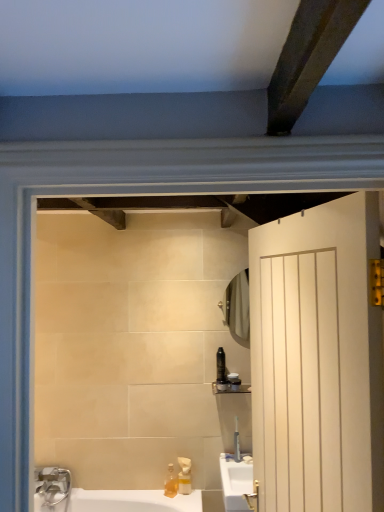
The height and width of the screenshot is (512, 384). What do you see at coordinates (222, 384) in the screenshot?
I see `translucent plastic bottle at upper center, which is counted as the 3th toiletry, starting from the top` at bounding box center [222, 384].

The image size is (384, 512). Find the location of `translucent plastic soap dispenser at lower center, the 1th soap dispenser positioned from the right`. translucent plastic soap dispenser at lower center, the 1th soap dispenser positioned from the right is located at coordinates (184, 476).

Where is `white wood door at right`? This screenshot has width=384, height=512. white wood door at right is located at coordinates (317, 359).

Measure the distance between point (218, 373) and camera.

They are 7.93 feet apart.

What do you see at coordinates (237, 306) in the screenshot?
I see `matte glass mirror at upper center` at bounding box center [237, 306].

Locate an element on the screen. translucent plastic bottle at upper center, placed as the second toiletry when sorted from bottom to top is located at coordinates [x=222, y=384].

Is clear plastic tube at upper center, positioned as the fourth toiletry in top-to-bottom order, far from translucent plastic soap dispenser at lower center, placed as the first soap dispenser when sorted from left to right?

That's not correct — clear plastic tube at upper center, positioned as the fourth toiletry in top-to-bottom order, is a little close to translucent plastic soap dispenser at lower center, placed as the first soap dispenser when sorted from left to right.

What's the angular difference between clear plastic tube at upper center, positioned as the fourth toiletry in top-to-bottom order, and translucent plastic soap dispenser at lower center, arranged as the 2th soap dispenser when viewed from the right,'s facing directions?

clear plastic tube at upper center, positioned as the fourth toiletry in top-to-bottom order, and translucent plastic soap dispenser at lower center, arranged as the 2th soap dispenser when viewed from the right, are facing 81.3 degrees away from each other.

Is clear plastic tube at upper center, positioned as the fourth toiletry in top-to-bottom order, oriented towards translucent plastic soap dispenser at lower center, placed as the first soap dispenser when sorted from left to right?

No, clear plastic tube at upper center, positioned as the fourth toiletry in top-to-bottom order, is not aimed at translucent plastic soap dispenser at lower center, placed as the first soap dispenser when sorted from left to right.

From the image's perspective, is clear plastic tube at upper center, which ranks as the first toiletry in bottom-to-top order, located above or below translucent plastic soap dispenser at lower center, arranged as the 2th soap dispenser when viewed from the right?

Based on their image positions, clear plastic tube at upper center, which ranks as the first toiletry in bottom-to-top order, is located above translucent plastic soap dispenser at lower center, arranged as the 2th soap dispenser when viewed from the right.

The height and width of the screenshot is (512, 384). Find the location of `the 4th toiletry in front of the matte glass mirror at upper center`. the 4th toiletry in front of the matte glass mirror at upper center is located at coordinates (222, 384).

Which is in front, point (229, 311) or point (216, 383)?

The point (216, 383) is more forward.

Is translucent plastic bottle at upper center, placed as the second toiletry when sorted from bottom to top, at the back of matte glass mirror at upper center?

No, matte glass mirror at upper center is not facing the opposite direction of translucent plastic bottle at upper center, placed as the second toiletry when sorted from bottom to top.

Looking at this image, does matte glass mirror at upper center have a larger size compared to translucent plastic bottle at upper center, which is counted as the 3th toiletry, starting from the top?

Yes.

Is translucent plastic soap dispenser at lower center, placed as the first soap dispenser when sorted from left to right, not near matte black container at upper right, the 2th toiletry in the top-to-bottom sequence?

translucent plastic soap dispenser at lower center, placed as the first soap dispenser when sorted from left to right, is near matte black container at upper right, the 2th toiletry in the top-to-bottom sequence, not far away.

Looking at this image, which of these two, translucent plastic soap dispenser at lower center, placed as the first soap dispenser when sorted from left to right, or matte black container at upper right, the 2th toiletry in the top-to-bottom sequence, stands taller?

Standing taller between the two is translucent plastic soap dispenser at lower center, placed as the first soap dispenser when sorted from left to right.

What's the angular difference between translucent plastic soap dispenser at lower center, placed as the first soap dispenser when sorted from left to right, and matte black container at upper right, which is the 3th toiletry from bottom to top,'s facing directions?

There is a 30.5-degree angle between the facing directions of translucent plastic soap dispenser at lower center, placed as the first soap dispenser when sorted from left to right, and matte black container at upper right, which is the 3th toiletry from bottom to top.

Is translucent plastic soap dispenser at lower center, placed as the first soap dispenser when sorted from left to right, closer to the viewer compared to matte black container at upper right, which is the 3th toiletry from bottom to top?

Yes, translucent plastic soap dispenser at lower center, placed as the first soap dispenser when sorted from left to right, is closer to the viewer.

Between matte black container at upper right, the 2th toiletry in the top-to-bottom sequence, and matte glass mirror at upper center, which one is positioned behind?

matte glass mirror at upper center is further away from the camera.

Which of these two, matte black container at upper right, which is the 3th toiletry from bottom to top, or matte glass mirror at upper center, stands shorter?

matte black container at upper right, which is the 3th toiletry from bottom to top.

From the image's perspective, relative to matte glass mirror at upper center, is matte black container at upper right, the 2th toiletry in the top-to-bottom sequence, above or below?

Clearly, from the image's perspective, matte black container at upper right, the 2th toiletry in the top-to-bottom sequence, is below matte glass mirror at upper center.

Can you confirm if matte black shelf at upper center is smaller than translucent plastic bottle at upper center, placed as the second toiletry when sorted from bottom to top?

No, matte black shelf at upper center is not smaller than translucent plastic bottle at upper center, placed as the second toiletry when sorted from bottom to top.

Is matte black shelf at upper center turned away from translucent plastic bottle at upper center, placed as the second toiletry when sorted from bottom to top?

No, matte black shelf at upper center is not facing away from translucent plastic bottle at upper center, placed as the second toiletry when sorted from bottom to top.

From the picture: Between matte black shelf at upper center and translucent plastic bottle at upper center, which is counted as the 3th toiletry, starting from the top, which one appears on the left side from the viewer's perspective?

translucent plastic bottle at upper center, which is counted as the 3th toiletry, starting from the top, is more to the left.

From a real-world perspective, between matte black shelf at upper center and translucent plastic bottle at upper center, which is counted as the 3th toiletry, starting from the top, who is vertically higher?

translucent plastic bottle at upper center, which is counted as the 3th toiletry, starting from the top.

Is matte black shelf at upper center oriented towards matte glass mirror at upper center?

No, matte black shelf at upper center does not turn towards matte glass mirror at upper center.

Which point is more distant from viewer, [224,391] or [231,295]?

Point [231,295]

Considering the positions of objects matte black shelf at upper center and matte glass mirror at upper center in the image provided, who is more to the left, matte black shelf at upper center or matte glass mirror at upper center?

matte black shelf at upper center is more to the left.

Does matte glass mirror at upper center have a lesser width compared to translucent plastic soap dispenser at lower center, placed as the first soap dispenser when sorted from left to right?

No, matte glass mirror at upper center is not thinner than translucent plastic soap dispenser at lower center, placed as the first soap dispenser when sorted from left to right.

This screenshot has width=384, height=512. What are the coordinates of `mirror behind the translucent plastic soap dispenser at lower center, placed as the first soap dispenser when sorted from left to right` in the screenshot? It's located at (237, 306).

Considering the relative sizes of matte glass mirror at upper center and translucent plastic soap dispenser at lower center, arranged as the 2th soap dispenser when viewed from the right, in the image provided, is matte glass mirror at upper center taller than translucent plastic soap dispenser at lower center, arranged as the 2th soap dispenser when viewed from the right,?

Yes, matte glass mirror at upper center is taller than translucent plastic soap dispenser at lower center, arranged as the 2th soap dispenser when viewed from the right.

The width and height of the screenshot is (384, 512). Identify the location of the 1st toiletry behind the translucent plastic soap dispenser at lower center, placed as the first soap dispenser when sorted from left to right. tap(237, 442).

There is a matte glass mirror at upper center. At what (x,y) coordinates should I click in order to perform the action: click on the 3rd toiletry below it (from a real-world perspective). Please return your answer as a coordinate pair (x, y). This screenshot has width=384, height=512. Looking at the image, I should click on (222, 384).

Based on their spatial positions, is translucent plastic soap dispenser at lower center, placed as the second soap dispenser when sorted from left to right, or matte black container at upper right, which is the 3th toiletry from bottom to top, closer to white wood door at right?

matte black container at upper right, which is the 3th toiletry from bottom to top.

From the image, which object appears to be farther from matte glass mirror at upper center, translucent plastic soap dispenser at lower center, the 1th soap dispenser positioned from the right, or black plastic toothbrush at upper center, the first toiletry from the top?

Among the two, translucent plastic soap dispenser at lower center, the 1th soap dispenser positioned from the right, is located further to matte glass mirror at upper center.

Looking at the image, which one is located closer to translucent plastic bottle at upper center, placed as the second toiletry when sorted from bottom to top, translucent plastic soap dispenser at lower center, the 1th soap dispenser positioned from the right, or matte black container at upper right, which is the 3th toiletry from bottom to top?

Based on the image, matte black container at upper right, which is the 3th toiletry from bottom to top, appears to be nearer to translucent plastic bottle at upper center, placed as the second toiletry when sorted from bottom to top.

Estimate the real-world distances between objects in this image. Which object is further from translucent plastic bottle at upper center, which is counted as the 3th toiletry, starting from the top, matte glass mirror at upper center or translucent plastic soap dispenser at lower center, arranged as the 2th soap dispenser when viewed from the right?

translucent plastic soap dispenser at lower center, arranged as the 2th soap dispenser when viewed from the right, is positioned further to the anchor translucent plastic bottle at upper center, which is counted as the 3th toiletry, starting from the top.

From the image, which object appears to be nearer to translucent plastic bottle at upper center, which is counted as the 3th toiletry, starting from the top, matte black container at upper right, the 2th toiletry in the top-to-bottom sequence, or matte glass mirror at upper center?

matte black container at upper right, the 2th toiletry in the top-to-bottom sequence.

From the image, which object appears to be nearer to translucent plastic bottle at upper center, which is counted as the 3th toiletry, starting from the top, translucent plastic soap dispenser at lower center, placed as the first soap dispenser when sorted from left to right, or translucent plastic soap dispenser at lower center, the 1th soap dispenser positioned from the right?

The object closer to translucent plastic bottle at upper center, which is counted as the 3th toiletry, starting from the top, is translucent plastic soap dispenser at lower center, the 1th soap dispenser positioned from the right.

Which object lies further to the anchor point matte black shelf at upper center, translucent plastic soap dispenser at lower center, the 1th soap dispenser positioned from the right, or black plastic toothbrush at upper center, the fourth toiletry from the bottom?

translucent plastic soap dispenser at lower center, the 1th soap dispenser positioned from the right, lies further to matte black shelf at upper center than the other object.

Looking at the image, which one is located further to white wood door at right, translucent plastic soap dispenser at lower center, placed as the first soap dispenser when sorted from left to right, or matte glass mirror at upper center?

translucent plastic soap dispenser at lower center, placed as the first soap dispenser when sorted from left to right, is positioned further to the anchor white wood door at right.

This screenshot has height=512, width=384. What are the coordinates of `balustrade between white wood door at right and matte glass mirror at upper center in the front-back direction` in the screenshot? It's located at (231, 388).

Locate an element on the screen. Image resolution: width=384 pixels, height=512 pixels. balustrade between black plastic toothbrush at upper center, the fourth toiletry from the bottom, and clear plastic tube at upper center, positioned as the fourth toiletry in top-to-bottom order, vertically is located at coordinates (231, 388).

Identify the location of soap dispenser positioned between white wood door at right and clear plastic tube at upper center, which ranks as the first toiletry in bottom-to-top order, from near to far. (171, 482).

You are a GUI agent. You are given a task and a screenshot of the screen. Output one action in this format:
    pyautogui.click(x=<x>, y=<y>)
    Task: Click on the balustrade positioned between white wood door at right and black plastic toothbrush at upper center, the first toiletry from the top, from near to far
    
    Given the screenshot: What is the action you would take?
    [231, 388]